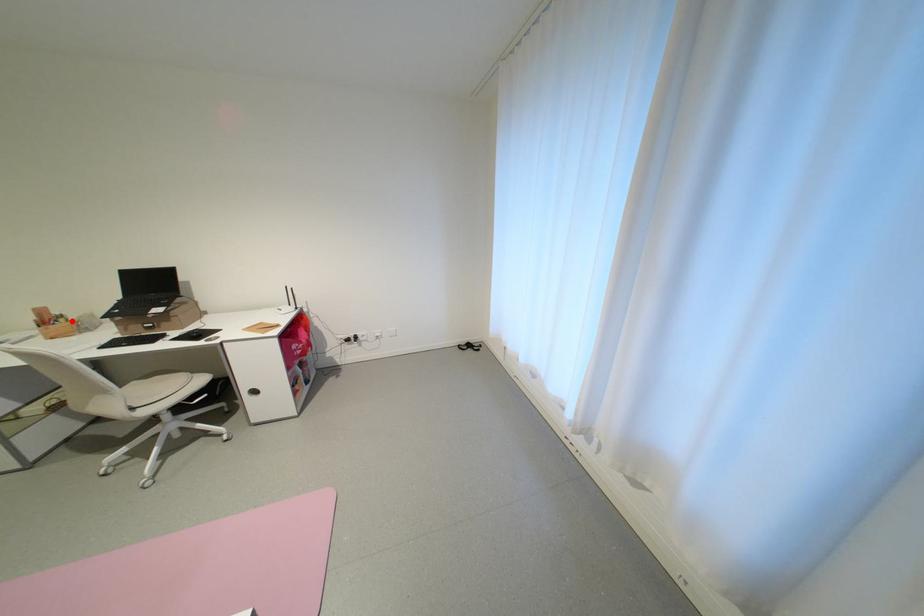
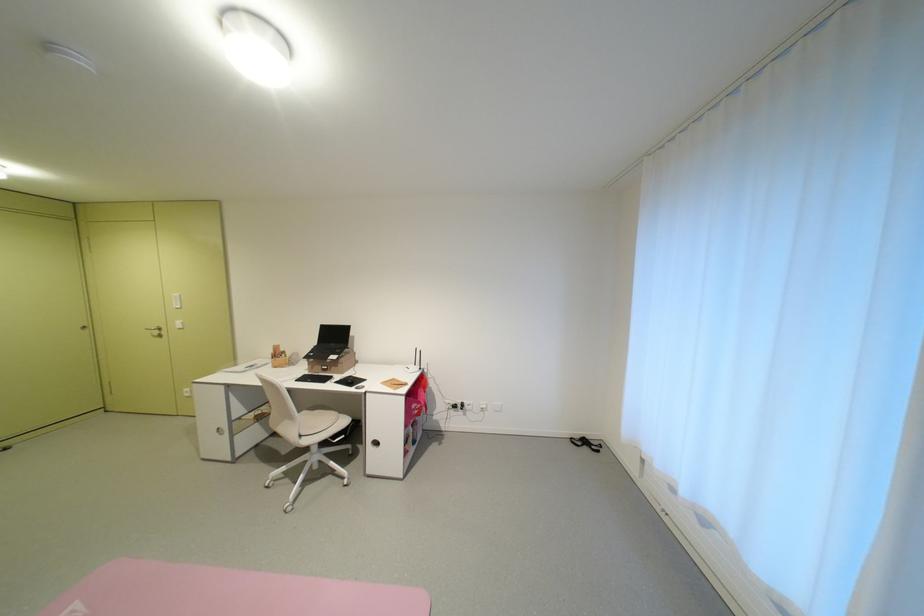
In the second image, find the point that corresponds to the highlighted location in the first image.

(293, 357)